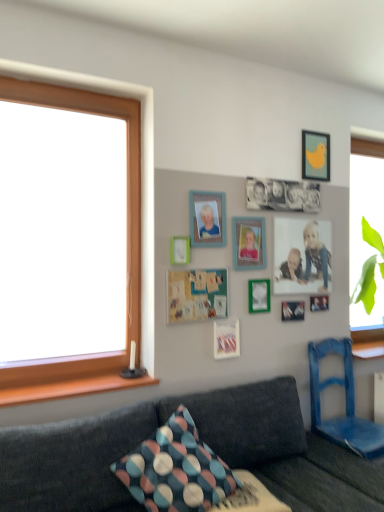
Identify the location of dark gray fabric couch at center. This screenshot has height=512, width=384. (202, 439).

What do you see at coordinates (72, 388) in the screenshot? The image size is (384, 512). I see `wooden at left` at bounding box center [72, 388].

The image size is (384, 512). I want to click on matte wooden photo frame at center, the fifth picture frame when ordered from left to right, so click(302, 256).

Where is `matte plastic photo frame at center, the 4th picture frame viewed from the right`? This screenshot has width=384, height=512. matte plastic photo frame at center, the 4th picture frame viewed from the right is located at coordinates (249, 243).

You are a GUI agent. You are given a task and a screenshot of the screen. Output one action in this format:
    pyautogui.click(x=<x>, y=<y>)
    Task: Click on the patterned fabric pillow at center
    This screenshot has width=384, height=512.
    Given the screenshot: What is the action you would take?
    pyautogui.click(x=176, y=469)

This screenshot has height=512, width=384. What are the coordinates of `dark gray fabric couch at center` in the screenshot? It's located at (202, 439).

Does matte wooden photo frame at center, the fifth picture frame when ordered from left to right, have a smaller size compared to metallic silver frame at center, the 3th decorative picture when ordered from top to bottom?

No.

Is matte wooden photo frame at center, the second picture frame when ordered from right to left, thinner than metallic silver frame at center, which is the second decorative picture from right to left?

Yes.

Can we say matte wooden photo frame at center, the second picture frame when ordered from right to left, lies outside metallic silver frame at center, positioned as the 2th decorative picture in bottom-to-top order?

Yes, matte wooden photo frame at center, the second picture frame when ordered from right to left, is outside of metallic silver frame at center, positioned as the 2th decorative picture in bottom-to-top order.

Could you measure the distance between matte wooden photo frame at center, the second picture frame when ordered from right to left, and metallic silver frame at center, which is the second decorative picture from right to left?

matte wooden photo frame at center, the second picture frame when ordered from right to left, is 12.24 inches from metallic silver frame at center, which is the second decorative picture from right to left.

Based on the photo, from the image's perspective, is patterned fabric pillow at center located above or below dark gray fabric couch at center?

Clearly, from the image's perspective, patterned fabric pillow at center is above dark gray fabric couch at center.

How much distance is there between patterned fabric pillow at center and dark gray fabric couch at center?

9.33 inches.

Between patterned fabric pillow at center and dark gray fabric couch at center, which one has smaller size?

Smaller between the two is patterned fabric pillow at center.

Is patterned fabric pillow at center outside of dark gray fabric couch at center?

No.

Is blue wooden chair at lower right in contact with matte wooden frame at lower right, placed as the 3th decorative picture when sorted from bottom to top?

blue wooden chair at lower right is not next to matte wooden frame at lower right, placed as the 3th decorative picture when sorted from bottom to top, and they're not touching.

Can matte wooden frame at lower right, the 2th decorative picture in the top-to-bottom sequence, be found inside blue wooden chair at lower right?

No, blue wooden chair at lower right does not contain matte wooden frame at lower right, the 2th decorative picture in the top-to-bottom sequence.

Which is more distant, (x=354, y=424) or (x=313, y=296)?

Positioned behind is point (x=313, y=296).

Which is more to the left, blue wooden chair at lower right or matte wooden frame at lower right, acting as the 1th decorative picture starting from the right?

Positioned to the left is matte wooden frame at lower right, acting as the 1th decorative picture starting from the right.

From the image's perspective, which is below, dark gray fabric couch at center or matte paper photo frame at center, arranged as the 4th decorative picture when viewed from the right?

From the image's view, dark gray fabric couch at center is below.

Measure the distance between dark gray fabric couch at center and matte paper photo frame at center, arranged as the 4th decorative picture when viewed from the right.

The distance of dark gray fabric couch at center from matte paper photo frame at center, arranged as the 4th decorative picture when viewed from the right, is 24.91 inches.

Identify the location of studio couch that is on the right side of matte paper photo frame at center, the first decorative picture positioned from the bottom. The height and width of the screenshot is (512, 384). (202, 439).

From a real-world perspective, is dark gray fabric couch at center on matte paper photo frame at center, acting as the 4th decorative picture starting from the top?

No.

Based on their positions, is matte plastic photo frame at upper center, the second picture frame positioned from the left, located to the left or right of yellow matte picture frame at upper right, which appears as the sixth picture frame when viewed from the left?

Based on their positions, matte plastic photo frame at upper center, the second picture frame positioned from the left, is located to the left of yellow matte picture frame at upper right, which appears as the sixth picture frame when viewed from the left.

Does matte plastic photo frame at upper center, arranged as the 5th picture frame when viewed from the right, come in front of yellow matte picture frame at upper right, which appears as the sixth picture frame when viewed from the left?

Yes, matte plastic photo frame at upper center, arranged as the 5th picture frame when viewed from the right, is in front of yellow matte picture frame at upper right, which appears as the sixth picture frame when viewed from the left.

Would you consider matte plastic photo frame at upper center, arranged as the 5th picture frame when viewed from the right, to be distant from yellow matte picture frame at upper right, which appears as the sixth picture frame when viewed from the left?

No.

Which object is positioned more to the left, matte plastic photo frame at upper center, arranged as the 5th picture frame when viewed from the right, or matte white picture frame at center, the 1th picture frame in the left-to-right sequence?

matte white picture frame at center, the 1th picture frame in the left-to-right sequence.

From a real-world perspective, is matte plastic photo frame at upper center, arranged as the 5th picture frame when viewed from the right, positioned above or below matte white picture frame at center, the 1th picture frame in the left-to-right sequence?

In terms of real-world spatial position, matte plastic photo frame at upper center, arranged as the 5th picture frame when viewed from the right, is above matte white picture frame at center, the 1th picture frame in the left-to-right sequence.

The height and width of the screenshot is (512, 384). In order to click on picture frame in front of the matte plastic photo frame at upper center, arranged as the 5th picture frame when viewed from the right in this screenshot , I will do `click(179, 250)`.

Would you say matte plastic photo frame at upper center, the second picture frame positioned from the left, is inside or outside matte white picture frame at center, the 1th picture frame in the left-to-right sequence?

matte plastic photo frame at upper center, the second picture frame positioned from the left, is outside matte white picture frame at center, the 1th picture frame in the left-to-right sequence.

Considering the sizes of objects patterned fabric pillow at center and wooden at left in the image provided, who is shorter, patterned fabric pillow at center or wooden at left?

wooden at left is shorter.

Is patterned fabric pillow at center touching wooden at left?

There is a gap between patterned fabric pillow at center and wooden at left.

This screenshot has width=384, height=512. Identify the location of pillow below the wooden at left (from the image's perspective). (176, 469).

How far apart are patterned fabric pillow at center and wooden at left?

patterned fabric pillow at center is 20.47 inches from wooden at left.

Locate an element on the screen. Image resolution: width=384 pixels, height=512 pixels. the 1st picture frame in front of the metallic silver frame at center, positioned as the 2th decorative picture in bottom-to-top order is located at coordinates (302, 256).

Identify the location of studio couch on the right of patterned fabric pillow at center. (202, 439).

Looking at the image, which one is located closer to black matte photograph at center, the first decorative picture when ordered from top to bottom, yellow matte picture frame at upper right, which ranks as the 1th picture frame in right-to-left order, or matte paper photo frame at center, the first decorative picture positioned from the bottom?

Among the two, yellow matte picture frame at upper right, which ranks as the 1th picture frame in right-to-left order, is located nearer to black matte photograph at center, the first decorative picture when ordered from top to bottom.

From the image, which object appears to be farther from metallic silver frame at center, positioned as the 2th decorative picture in bottom-to-top order, matte wooden frame at lower right, placed as the 3th decorative picture when sorted from bottom to top, or matte plastic photo frame at upper center, arranged as the 5th picture frame when viewed from the right?

The object further to metallic silver frame at center, positioned as the 2th decorative picture in bottom-to-top order, is matte plastic photo frame at upper center, arranged as the 5th picture frame when viewed from the right.

From the image, which object appears to be farther from metallic silver frame at center, arranged as the 3th decorative picture when viewed from the left, yellow matte picture frame at upper right, which appears as the sixth picture frame when viewed from the left, or matte plastic photo frame at upper center, arranged as the 5th picture frame when viewed from the right?

Among the two, yellow matte picture frame at upper right, which appears as the sixth picture frame when viewed from the left, is located further to metallic silver frame at center, arranged as the 3th decorative picture when viewed from the left.

Based on their spatial positions, is blue wooden chair at lower right or dark gray fabric couch at center closer to patterned fabric pillow at center?

Among the two, dark gray fabric couch at center is located nearer to patterned fabric pillow at center.

Which object lies further to the anchor point matte wooden photo frame at center, the second picture frame when ordered from right to left, yellow matte picture frame at upper right, which ranks as the 1th picture frame in right-to-left order, or matte white picture frame at center, acting as the sixth picture frame starting from the right?

matte white picture frame at center, acting as the sixth picture frame starting from the right, is positioned further to the anchor matte wooden photo frame at center, the second picture frame when ordered from right to left.

Which object lies further to the anchor point patterned fabric pillow at center, wooden at left or yellow matte picture frame at upper right, which appears as the sixth picture frame when viewed from the left?

yellow matte picture frame at upper right, which appears as the sixth picture frame when viewed from the left, is positioned further to the anchor patterned fabric pillow at center.

Estimate the real-world distances between objects in this image. Which object is closer to green felt bulletin board at center, black matte photograph at center, which appears as the fourth decorative picture when ordered from the bottom, or dark gray fabric couch at center?

black matte photograph at center, which appears as the fourth decorative picture when ordered from the bottom, is closer to green felt bulletin board at center.

Looking at the image, which one is located further to matte wooden photo frame at center, the fifth picture frame when ordered from left to right, matte wooden frame at lower right, acting as the 1th decorative picture starting from the right, or matte paper photo frame at center, the 1th decorative picture when ordered from left to right?

Among the two, matte paper photo frame at center, the 1th decorative picture when ordered from left to right, is located further to matte wooden photo frame at center, the fifth picture frame when ordered from left to right.

This screenshot has height=512, width=384. Identify the location of bulletin board between wooden at left and matte wooden frame at lower right, the 2th decorative picture in the top-to-bottom sequence, in the horizontal direction. (196, 295).

I want to click on bulletin board located between matte white picture frame at center, acting as the sixth picture frame starting from the right, and matte wooden frame at lower right, which is the fourth decorative picture from left to right, in the left-right direction, so click(196, 295).

The height and width of the screenshot is (512, 384). What are the coordinates of `bulletin board between matte white picture frame at center, acting as the sixth picture frame starting from the right, and matte plastic photo frame at center, marked as the 3th picture frame in a left-to-right arrangement, in the horizontal direction` in the screenshot? It's located at (196, 295).

This screenshot has height=512, width=384. I want to click on bulletin board that lies between matte white picture frame at center, the 1th picture frame in the left-to-right sequence, and wooden at left from top to bottom, so click(x=196, y=295).